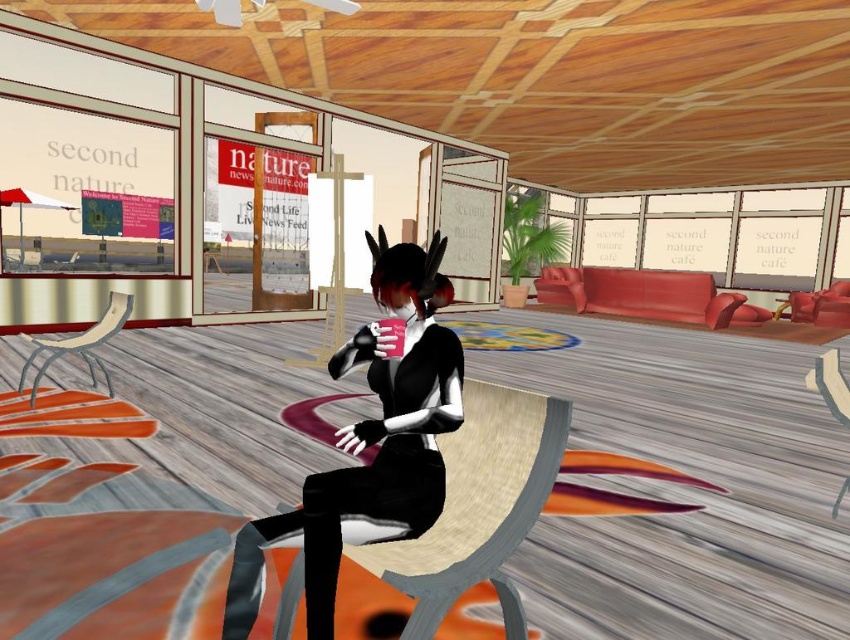
You are standing in the virtual environment of the Second Life cafe. There is a metallic silver chair at left. Can you walk up to it without moving past the central character?

The metallic silver chair at left is 9.39 feet away from the viewer. Since this distance is manageable, you can walk up to it without moving past the central character.

You are a virtual assistant in the Second Life environment. You need to determine if a new avatar can comfortably sit on the wooden textured chair at lower right while wearing the black matte dress at center. Based on their sizes, is this feasible?

The black matte dress at center is taller than the wooden textured chair at lower right, so the avatar may not be able to sit comfortably as the dress might be too tall for the chair.